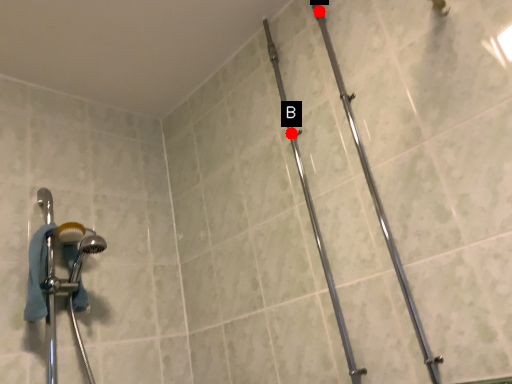
Question: Two points are circled on the image, labeled by A and B beside each circle. Which point is farther to the camera?

Choices:
 (A) A is further
 (B) B is further

Answer: (B)